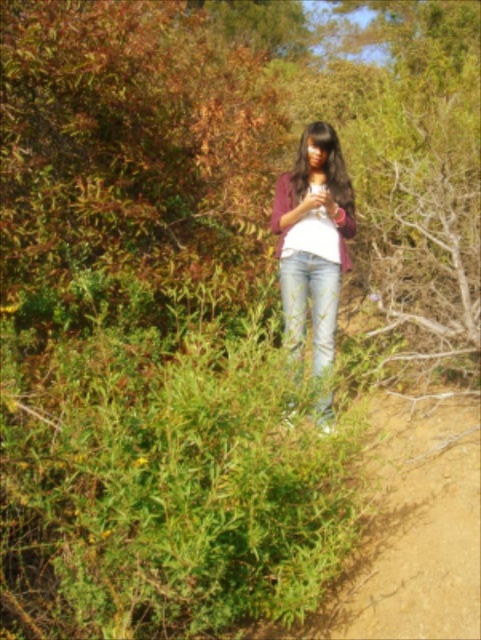
In the scene shown: You are a hiker on the trail and you see a person wearing a matte purple sweater at center and light blue denim jeans at center. Which clothing item is taller?

The matte purple sweater at center is much taller than the light blue denim jeans at center.

You are a hiker trying to locate your friend wearing a matte purple sweater at center in a natural outdoor setting. Based on the coordinates provided, where should you look relative to the dirt path that curves gently to the right in the midground?

The matte purple sweater at center is located at coordinates point (314,240), which places it near the center of the image. Since the dirt path curves gently to the right in the midground, your friend wearing the matte purple sweater at center is positioned slightly to the left of the path.

You are a hiker carrying a backpack that measures 5 inches in width. You want to place your backpack between the matte purple sweater at center and the light blue denim jeans at center. Will the backpack fit in the space between them?

The distance between the matte purple sweater at center and the light blue denim jeans at center is 5.54 inches. Since the backpack is 5 inches wide, it will fit with a small amount of space remaining.